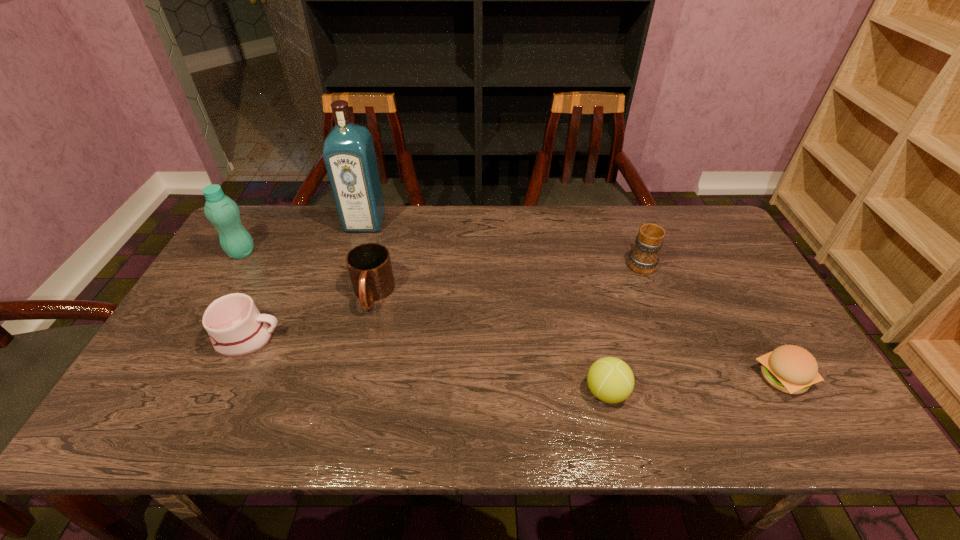
This screenshot has width=960, height=540. Find the location of `bottle that is at the far edge`. bottle that is at the far edge is located at coordinates (220, 210).

Locate an element on the screen. The image size is (960, 540). mug at the far edge is located at coordinates (643, 258).

Where is `object at the near edge`? object at the near edge is located at coordinates click(x=611, y=380).

Locate an element on the screen. bottle present at the left edge is located at coordinates (220, 210).

The height and width of the screenshot is (540, 960). Find the location of `mug that is at the left edge`. mug that is at the left edge is located at coordinates (236, 328).

Locate an element on the screen. The image size is (960, 540). object positioned at the right edge is located at coordinates (791, 369).

Identify the location of object present at the far left corner. (220, 210).

Find the location of a particular element. This screenshot has width=960, height=540. vacant region at the far edge of the desktop is located at coordinates (527, 205).

I want to click on free point at the left edge, so click(x=214, y=352).

Image resolution: width=960 pixels, height=540 pixels. Identify the location of free spot at the right edge of the desktop. (751, 342).